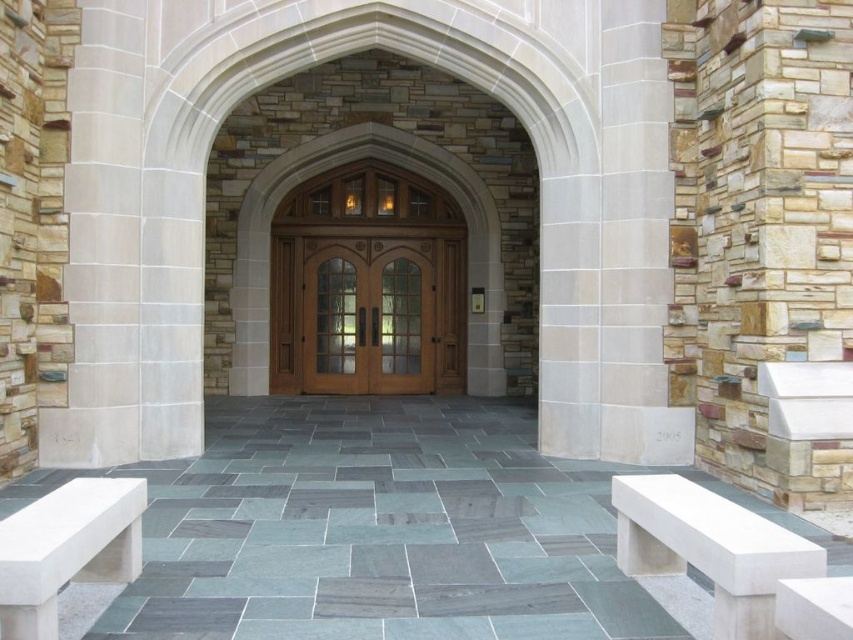
Between point (728, 554) and point (790, 630), which one is positioned in front?

Positioned in front is point (790, 630).

At what (x,y) coordinates should I click in order to perform the action: click on white stone bench at lower right. Please return your answer as a coordinate pair (x, y). Image resolution: width=853 pixels, height=640 pixels. Looking at the image, I should click on (711, 548).

Is mahogany wood double doors at center wider than white stone bench at lower right?

Yes.

Does point (402, 392) lie behind point (699, 563)?

Yes, it is behind point (699, 563).

Describe the element at coordinates (367, 314) in the screenshot. I see `mahogany wood double doors at center` at that location.

Identify the location of mahogany wood double doors at center. Image resolution: width=853 pixels, height=640 pixels. (367, 314).

Does white stone bench at lower left have a larger size compared to white smooth bench at lower right?

Yes.

Locate an element on the screen. white stone bench at lower left is located at coordinates pyautogui.click(x=67, y=548).

Identify the location of white stone bench at lower left. 67,548.